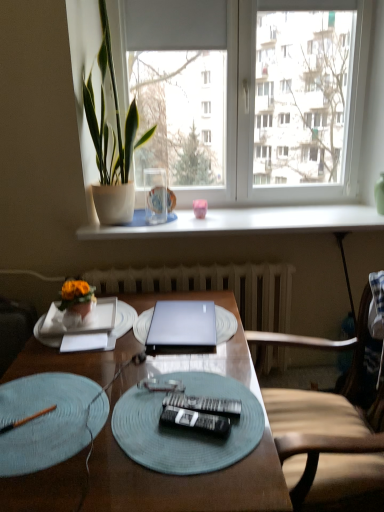
Where is `vacant space in front of black plastic remote control at center, marked as the second remote control in a back-to-front arrangement`? vacant space in front of black plastic remote control at center, marked as the second remote control in a back-to-front arrangement is located at coordinates (193, 470).